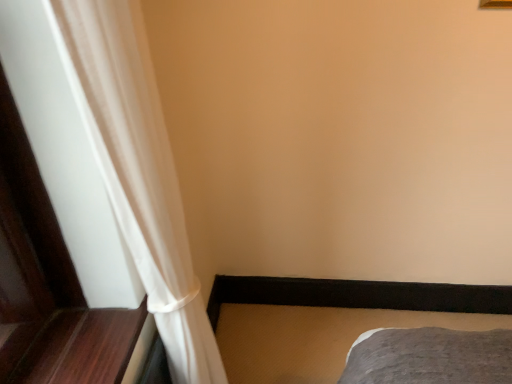
Question: From a real-world perspective, is white sheer curtain at left positioned over gray fabric bed frame at lower right based on gravity?

Choices:
 (A) yes
 (B) no

Answer: (A)

Question: Considering the relative sizes of white sheer curtain at left and gray fabric bed frame at lower right in the image provided, is white sheer curtain at left bigger than gray fabric bed frame at lower right?

Choices:
 (A) yes
 (B) no

Answer: (A)

Question: Considering the relative sizes of white sheer curtain at left and gray fabric bed frame at lower right in the image provided, is white sheer curtain at left thinner than gray fabric bed frame at lower right?

Choices:
 (A) no
 (B) yes

Answer: (B)

Question: Considering the relative sizes of white sheer curtain at left and gray fabric bed frame at lower right in the image provided, is white sheer curtain at left smaller than gray fabric bed frame at lower right?

Choices:
 (A) yes
 (B) no

Answer: (B)

Question: From the image's perspective, is white sheer curtain at left below gray fabric bed frame at lower right?

Choices:
 (A) no
 (B) yes

Answer: (A)

Question: Is white sheer curtain at left facing towards gray fabric bed frame at lower right?

Choices:
 (A) no
 (B) yes

Answer: (A)

Question: Considering the relative sizes of gray fabric bed frame at lower right and white sheer curtain at left in the image provided, is gray fabric bed frame at lower right thinner than white sheer curtain at left?

Choices:
 (A) yes
 (B) no

Answer: (B)

Question: From the image's perspective, is gray fabric bed frame at lower right located beneath white sheer curtain at left?

Choices:
 (A) yes
 (B) no

Answer: (A)

Question: Is gray fabric bed frame at lower right further to camera compared to white sheer curtain at left?

Choices:
 (A) no
 (B) yes

Answer: (B)

Question: Is gray fabric bed frame at lower right at the right side of white sheer curtain at left?

Choices:
 (A) no
 (B) yes

Answer: (B)

Question: Can you confirm if gray fabric bed frame at lower right is wider than white sheer curtain at left?

Choices:
 (A) yes
 (B) no

Answer: (A)

Question: Is gray fabric bed frame at lower right positioned in front of white sheer curtain at left?

Choices:
 (A) no
 (B) yes

Answer: (A)

Question: Considering their positions, is white sheer curtain at left located in front of or behind gray fabric bed frame at lower right?

Choices:
 (A) behind
 (B) front

Answer: (B)